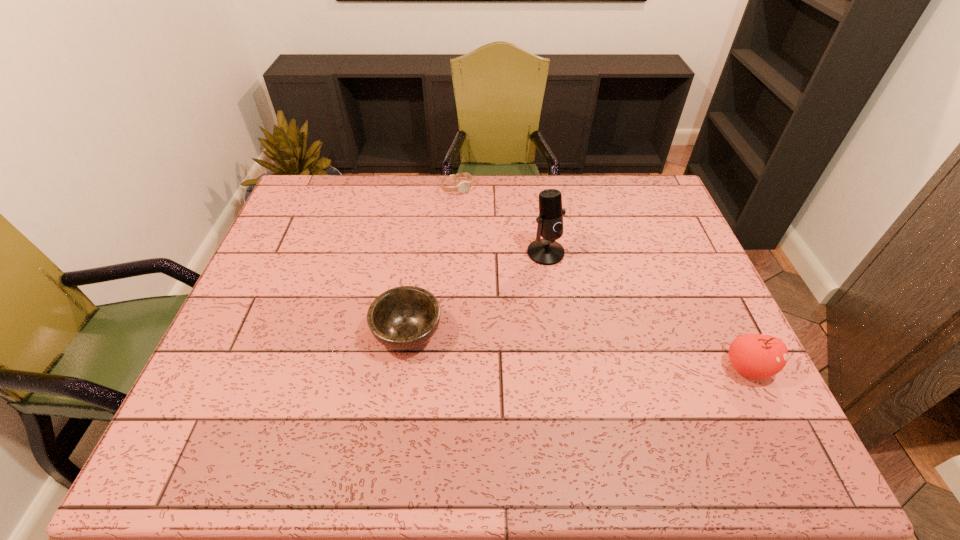
What are the coordinates of `the second shortest object` in the screenshot? It's located at (402, 318).

Where is `apple`? apple is located at coordinates (758, 356).

Locate an element on the screen. The width and height of the screenshot is (960, 540). the rightmost object is located at coordinates (758, 356).

Image resolution: width=960 pixels, height=540 pixels. I want to click on microphone, so pyautogui.click(x=547, y=251).

The image size is (960, 540). In order to click on the third object from left to right in this screenshot , I will do `click(547, 251)`.

At what (x,y) coordinates should I click in order to perform the action: click on the shortest object. Please return your answer as a coordinate pair (x, y). This screenshot has height=540, width=960. Looking at the image, I should click on (463, 186).

Image resolution: width=960 pixels, height=540 pixels. What are the coordinates of `the farthest object` in the screenshot? It's located at (463, 186).

Identify the location of free space located on the right of the bowl. Image resolution: width=960 pixels, height=540 pixels. (581, 333).

Locate an element on the screen. This screenshot has width=960, height=540. vacant space located on the left of the second tallest object is located at coordinates (621, 368).

What are the coordinates of `free spot located on the stand of the microphone` in the screenshot? It's located at (583, 320).